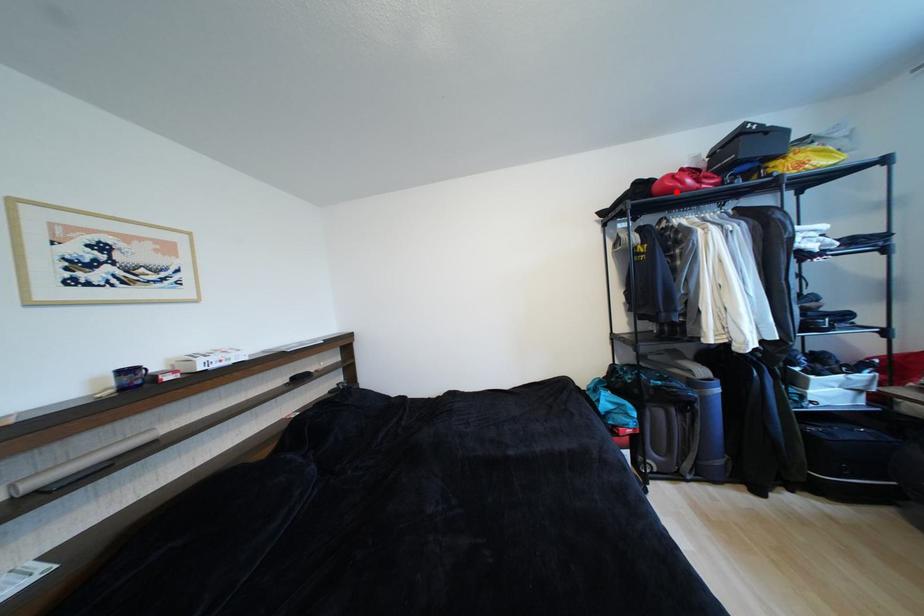
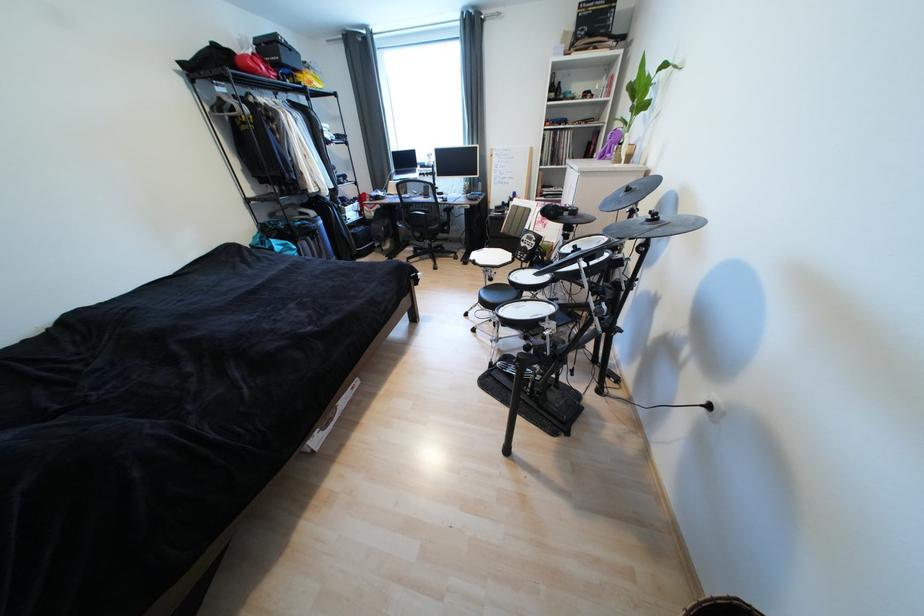
The point at the highlighted location is marked in the first image. Where is the corresponding point in the second image?

(261, 73)